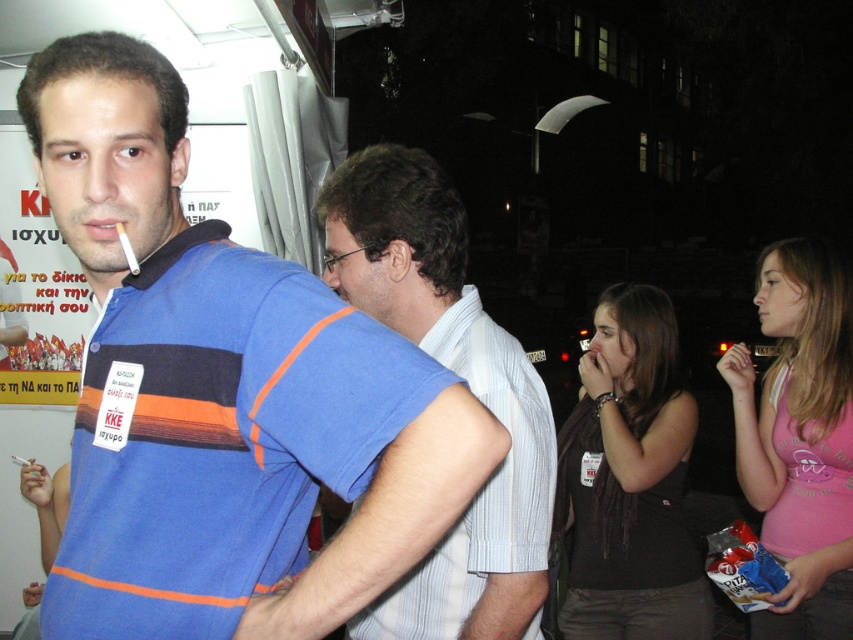
Question: Observing the image, what is the correct spatial positioning of blue striped polo shirt at center in reference to pink cotton tank top at lower right?

Choices:
 (A) left
 (B) right

Answer: (A)

Question: Is blue striped polo shirt at center below dark brown fabric tank top at center?

Choices:
 (A) no
 (B) yes

Answer: (A)

Question: Which of the following is the closest to the observer?

Choices:
 (A) (764, 477)
 (B) (369, 628)

Answer: (B)

Question: Can you confirm if striped cotton shirt at center is smaller than pink cotton tank top at lower right?

Choices:
 (A) no
 (B) yes

Answer: (A)

Question: Which point is farther to the camera?

Choices:
 (A) (460, 372)
 (B) (111, 284)
 (C) (787, 560)
 (D) (608, 620)

Answer: (D)

Question: Among these points, which one is nearest to the camera?

Choices:
 (A) (289, 525)
 (B) (527, 451)

Answer: (A)